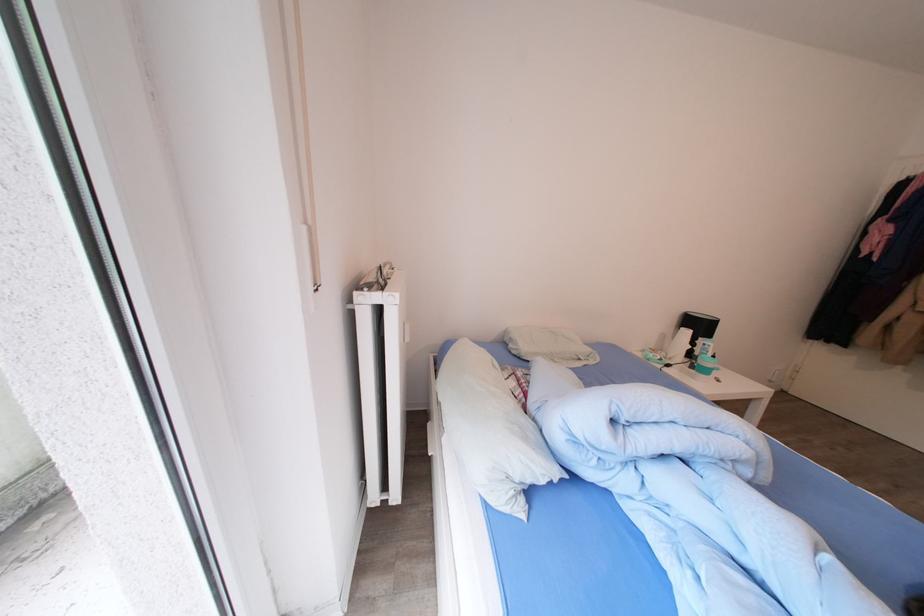
Where would you turn the radiator knob? Please return your answer as a coordinate pair (x, y).

(396, 331)